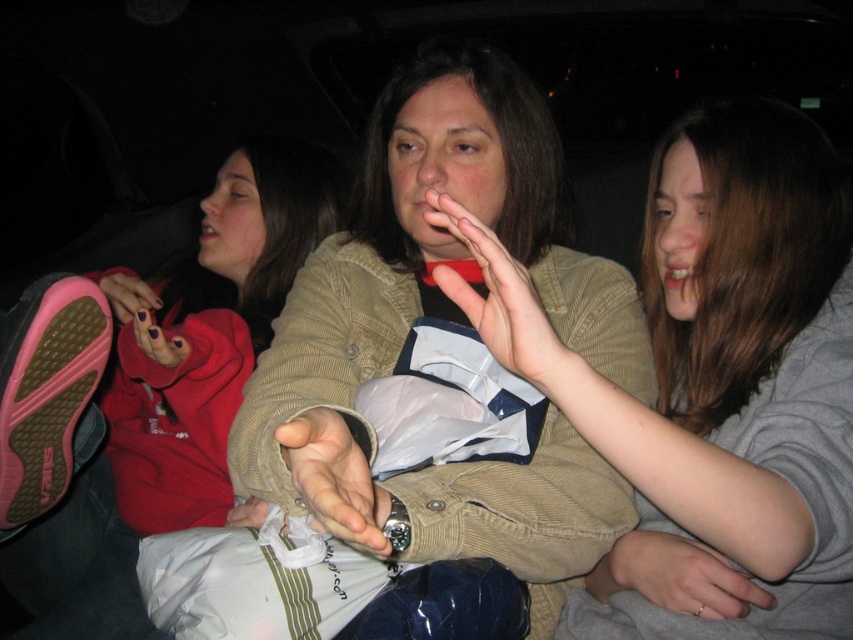
Is point (370, 554) closer to camera compared to point (706, 561)?

Yes.

Is point (338, 448) closer to camera compared to point (688, 563)?

Yes, it is in front of point (688, 563).

At what (x,y) coordinates should I click in order to perform the action: click on smooth beige hand at center. Please return your answer as a coordinate pair (x, y). This screenshot has height=640, width=853. Looking at the image, I should click on (334, 480).

Does pink fabric at lower left have a lesser height compared to dark purple nail polish at lower left?

No, pink fabric at lower left is not shorter than dark purple nail polish at lower left.

Identify the location of pink fabric at lower left. Image resolution: width=853 pixels, height=640 pixels. (128, 296).

Between matte beige sweater at center and pink fabric at lower left, which one has more height?

Standing taller between the two is matte beige sweater at center.

Between matte beige sweater at center and pink fabric at lower left, which one appears on the left side from the viewer's perspective?

pink fabric at lower left is more to the left.

At what (x,y) coordinates should I click in order to perform the action: click on matte beige sweater at center. Please return your answer as a coordinate pair (x, y). Looking at the image, I should click on (712, 385).

At what (x,y) coordinates should I click in order to perform the action: click on matte beige sweater at center. Please return your answer as a coordinate pair (x, y). The image size is (853, 640). Looking at the image, I should click on (712, 385).